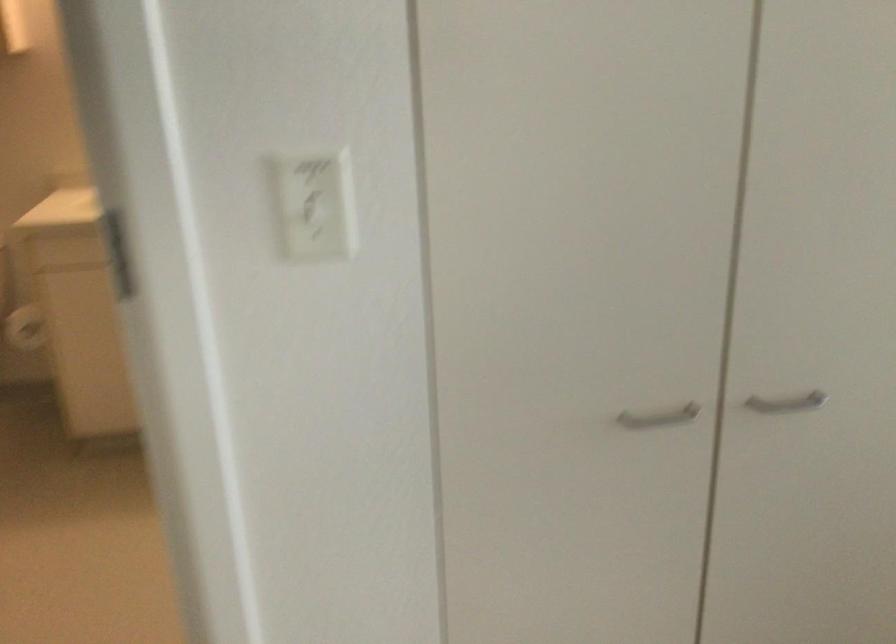
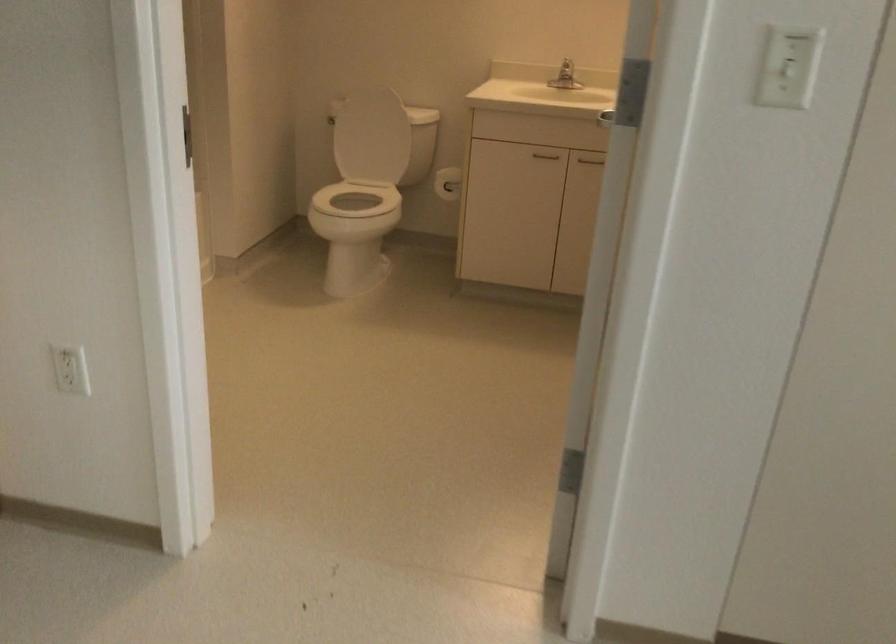
Question: The images are taken continuously from a first-person perspective. In which direction is your viewpoint rotating?

Choices:
 (A) Left
 (B) Right
 (C) Up
 (D) Down

Answer: (A)